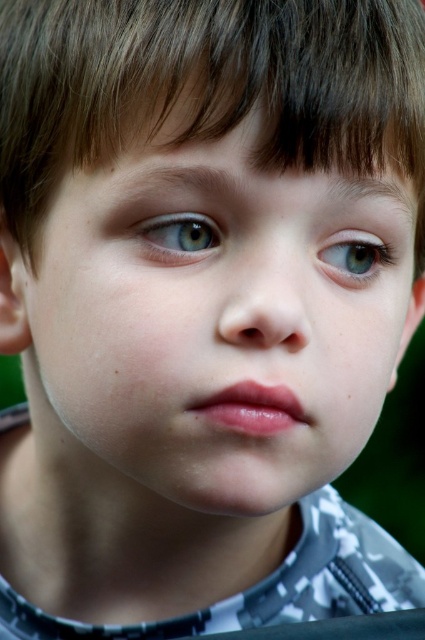
Does point (105, 401) come behind point (346, 276)?

No, it is not.

Where is `smooth skin face at center`? smooth skin face at center is located at coordinates (214, 321).

Is the position of smooth skin face at center less distant than that of green matte eye at upper left?

Yes, smooth skin face at center is in front of green matte eye at upper left.

Between smooth skin face at center and green matte eye at upper left, which one has more height?

Standing taller between the two is smooth skin face at center.

Which is in front, point (379, 173) or point (150, 236)?

Positioned in front is point (150, 236).

Locate an element on the screen. The image size is (425, 640). smooth skin face at center is located at coordinates (214, 321).

Is point (320, 248) positioned before point (203, 225)?

No, it is behind (203, 225).

Locate an element on the screen. light blue eye at center is located at coordinates (354, 257).